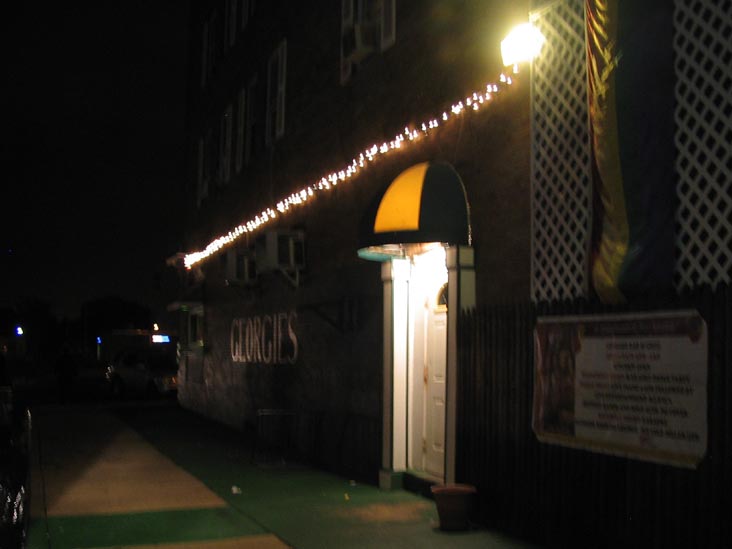
Locate an element on the screen. The width and height of the screenshot is (732, 549). window is located at coordinates (447, 298).